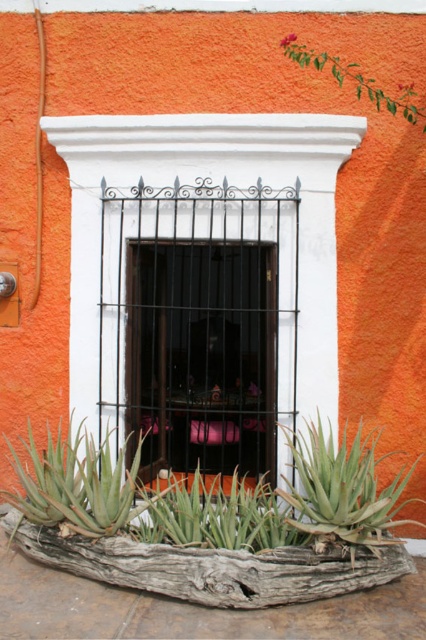
Question: Among these objects, which one is farthest from the camera?

Choices:
 (A) green leafy branch at upper right
 (B) green succulent at lower left
 (C) matte black window at center

Answer: (C)

Question: Where is weathered wood log at lower center located in relation to green succulent at lower center in the image?

Choices:
 (A) left
 (B) right

Answer: (A)

Question: Is green succulent at lower center smaller than green leafy branch at upper right?

Choices:
 (A) yes
 (B) no

Answer: (B)

Question: Which of the following is the closest to the observer?

Choices:
 (A) green leafy branch at upper right
 (B) matte black window at center
 (C) green succulent at lower left
 (D) green succulent at lower center

Answer: (D)

Question: Can you confirm if weathered wood log at lower center is positioned to the left of green succulent at lower center?

Choices:
 (A) no
 (B) yes

Answer: (B)

Question: Which point is farther from the camera taking this photo?

Choices:
 (A) [141, 426]
 (B) [419, 102]
 (C) [313, 506]
 (D) [143, 440]

Answer: (A)